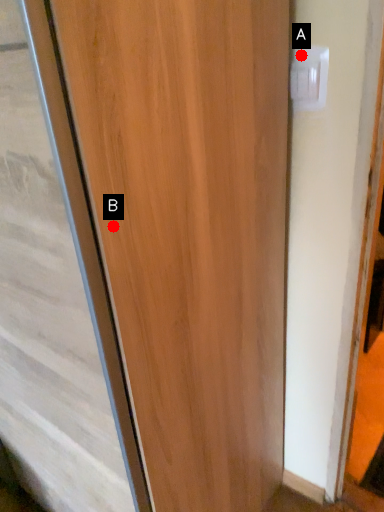
Question: Two points are circled on the image, labeled by A and B beside each circle. Which of the following is the farthest from the observer?

Choices:
 (A) A is further
 (B) B is further

Answer: (A)